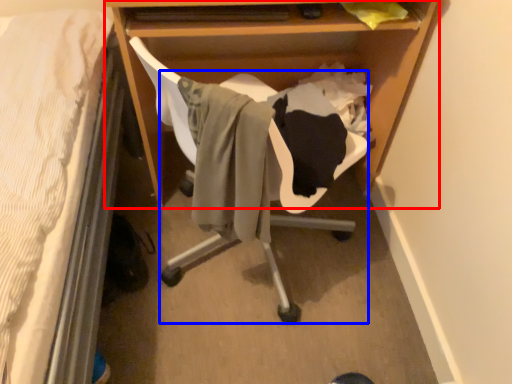
Question: Which point is further to the camera, desk (highlighted by a red box) or swivel chair (highlighted by a blue box)?

Choices:
 (A) desk
 (B) swivel chair

Answer: (A)